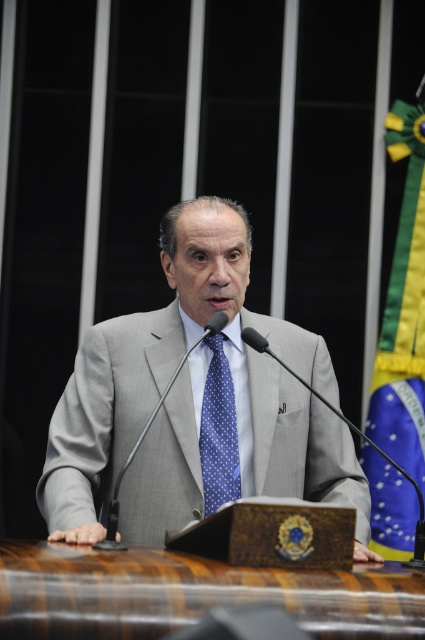
You are an event planner setting up a camera to capture the speaker wearing the gray fabric suit at center. Based on the coordinates provided, where should the camera be positioned relative to the podium to ensure the suit is centered in the frame?

The gray fabric suit at center is located at point (195, 403), so the camera should be positioned to center the frame on those coordinates to capture the suit properly.

You are a tailor who needs to adjust the size of the gray fabric suit at center and the blue dotted fabric tie at center. Which item requires more fabric to make larger?

The gray fabric suit at center requires more fabric to make larger since it is bigger than the blue dotted fabric tie at center.

You are a photographer at a formal event and need to capture a closeup of the speaker while ensuring both the blue fabric flag at right and the blue dotted fabric tie at center are visible in the frame. Which object should you position closer to the center of the photo to include both?

The blue fabric flag at right is positioned on the right side of the blue dotted fabric tie at center. To include both in the frame, position the blue fabric flag at right closer to the center so that it remains within the photo while keeping the blue dotted fabric tie at center near the middle.